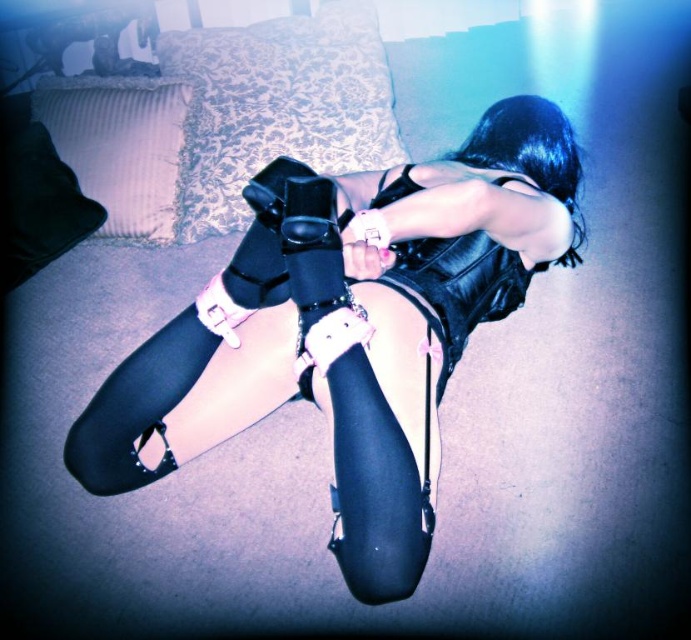
Does black leather gloves at center appear over black leather corset at center?

No, black leather gloves at center is not above black leather corset at center.

Does black leather gloves at center appear on the left side of black leather corset at center?

Correct, you'll find black leather gloves at center to the left of black leather corset at center.

The image size is (691, 640). Identify the location of black leather gloves at center. (350, 326).

Is velvet-patterned pillow at upper center positioned in front of white fabric pillow at upper left?

No, it is not.

At what (x,y) coordinates should I click in order to perform the action: click on velvet-patterned pillow at upper center. Please return your answer as a coordinate pair (x, y). Looking at the image, I should click on (276, 106).

Where is `velvet-patterned pillow at upper center`? Image resolution: width=691 pixels, height=640 pixels. velvet-patterned pillow at upper center is located at coordinates (276, 106).

Which is more to the right, white fabric pillow at upper left or black leather corset at center?

From the viewer's perspective, black leather corset at center appears more on the right side.

Does white fabric pillow at upper left appear on the left side of black leather corset at center?

Indeed, white fabric pillow at upper left is positioned on the left side of black leather corset at center.

Is point (97, 131) positioned behind point (422, 188)?

Yes, point (97, 131) is farther from viewer.

Find the location of a particular element. The height and width of the screenshot is (640, 691). white fabric pillow at upper left is located at coordinates (120, 147).